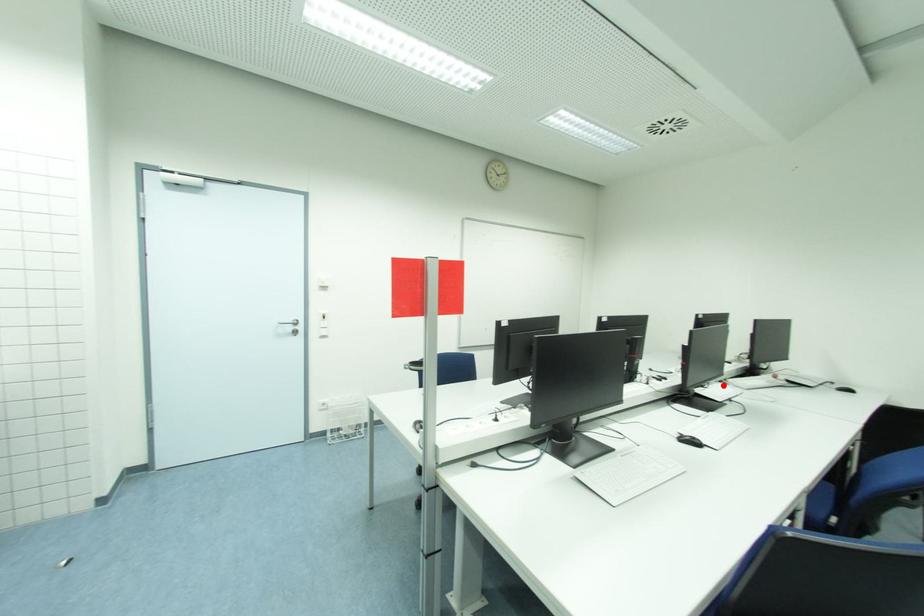
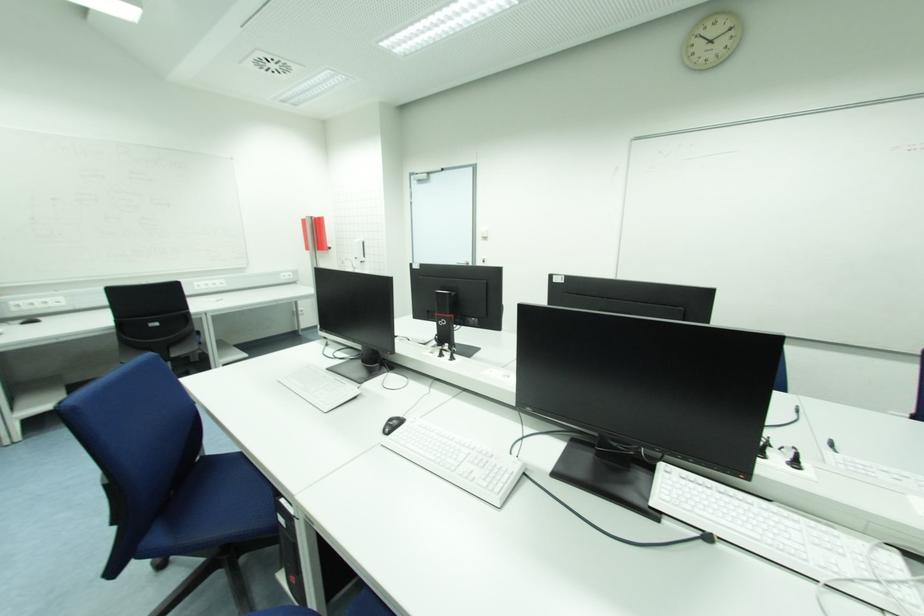
Question: I am providing you with two images of the same scene from different viewpoints. In image1, a red point is highlighted. Considering the same 3D point in image2, which of the following is correct?

Choices:
 (A) It is closer
 (B) It is farther

Answer: (A)